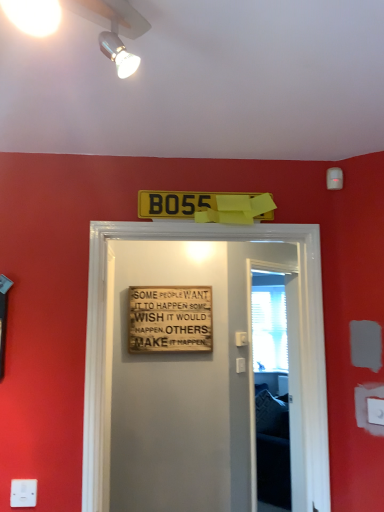
Question: Which is correct: white plastic electric outlet at lower right, the 1th electric outlet positioned from the back, is inside transparent plastic screen door at center, or outside of it?

Choices:
 (A) inside
 (B) outside

Answer: (B)

Question: From their relative heights in the image, would you say white plastic electric outlet at lower right, marked as the second electric outlet in a front-to-back arrangement, is taller or shorter than transparent plastic screen door at center?

Choices:
 (A) short
 (B) tall

Answer: (A)

Question: Which object is the closest to the white plastic electric outlet at lower left, which ranks as the first electric outlet in bottom-to-top order?

Choices:
 (A) white glossy spotlight at upper center
 (B) transparent plastic screen door at center
 (C) white mesh screen at right
 (D) white plastic electric outlet at lower right, which is the 2th electric outlet in left-to-right order
 (E) wooden sign at center, arranged as the 2th warning sign when viewed from the front

Answer: (D)

Question: Which object is positioned closest to the white plastic electric outlet at lower right, the 1th electric outlet viewed from the right?

Choices:
 (A) white mesh screen at right
 (B) wooden signboard at center
 (C) yellow plastic license plate at center, positioned as the 2th warning sign in back-to-front order
 (D) transparent plastic screen door at center
 (E) white glossy spotlight at upper center

Answer: (B)